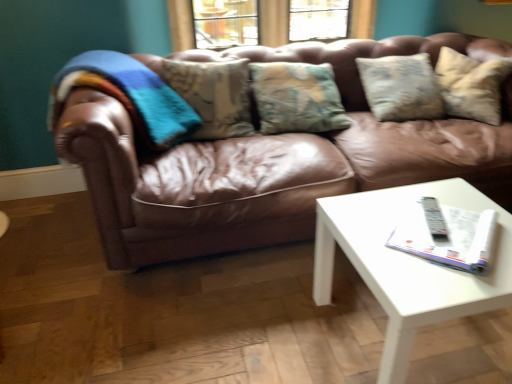
Where is `blank space above white glossy coffee table at lower right (from a real-world perspective)`? This screenshot has height=384, width=512. blank space above white glossy coffee table at lower right (from a real-world perspective) is located at coordinates (429, 236).